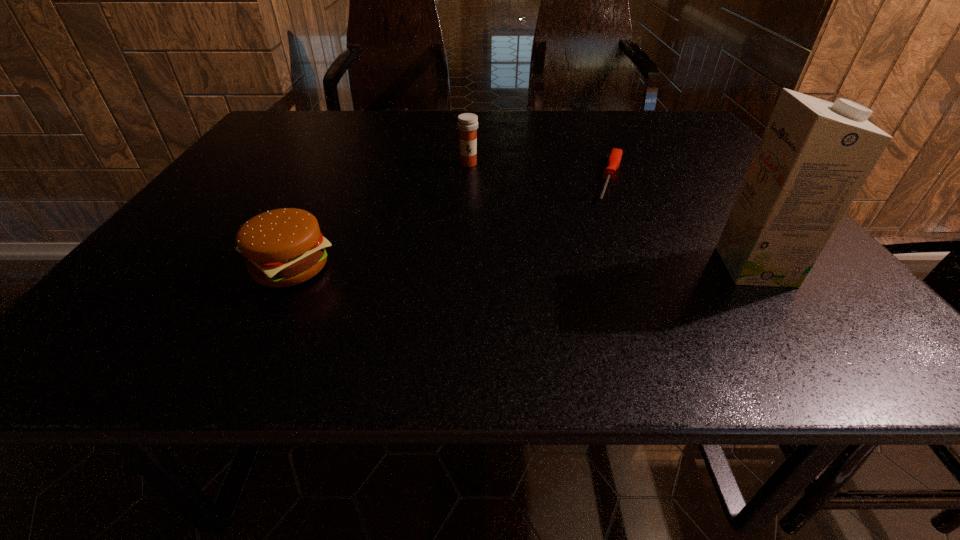
This screenshot has width=960, height=540. Find the location of `free spot located on the label side of the third object from right to left`. free spot located on the label side of the third object from right to left is located at coordinates (467, 198).

At what (x,y) coordinates should I click in order to perform the action: click on vacant region located 0.330m on the label side of the third object from right to left. Please return your answer as a coordinate pair (x, y). The image size is (960, 540). Looking at the image, I should click on (465, 244).

Locate an element on the screen. The height and width of the screenshot is (540, 960). free space located on the label side of the third object from right to left is located at coordinates (466, 225).

Identify the location of free space located 0.330m at the tip of the second object from right to left. (585, 294).

Identify the location of free spot located at the tip of the second object from right to left. (599, 249).

At what (x,y) coordinates should I click in order to perform the action: click on vacant space located 0.320m at the tip of the second object from right to left. Please return your answer as a coordinate pair (x, y). This screenshot has width=960, height=540. Looking at the image, I should click on (587, 291).

Locate an element on the screen. This screenshot has width=960, height=540. hamburger present at the near edge is located at coordinates (x=284, y=247).

Locate an element on the screen. carton located in the near edge section of the desktop is located at coordinates (814, 156).

The height and width of the screenshot is (540, 960). Identify the location of object at the right edge. (814, 156).

Locate an element on the screen. The height and width of the screenshot is (540, 960). object present at the near right corner is located at coordinates (814, 156).